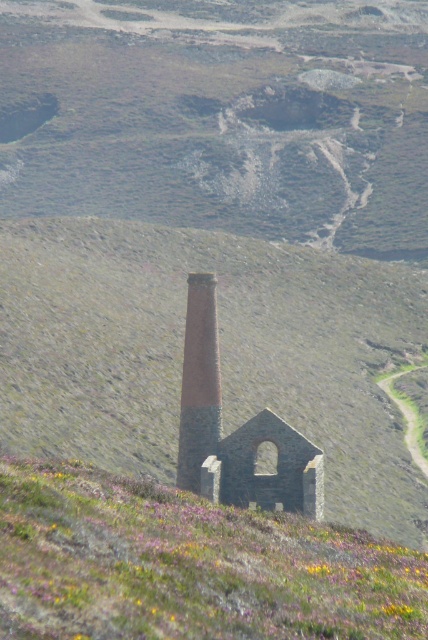
Question: Which point is closer to the camera taking this photo?

Choices:
 (A) (47, 406)
 (B) (354, 547)

Answer: (B)

Question: Does rustic stone tower at center appear on the left side of red brick chimney at center?

Choices:
 (A) yes
 (B) no

Answer: (B)

Question: Is the position of rustic stone tower at center less distant than that of red brick chimney at center?

Choices:
 (A) yes
 (B) no

Answer: (A)

Question: Is rustic stone tower at center to the right of red brick chimney at center from the viewer's perspective?

Choices:
 (A) yes
 (B) no

Answer: (A)

Question: Which point appears farthest from the camera in this image?

Choices:
 (A) (107, 444)
 (B) (380, 580)

Answer: (A)

Question: Which point appears farthest from the camera in this image?

Choices:
 (A) (332, 467)
 (B) (388, 561)

Answer: (A)